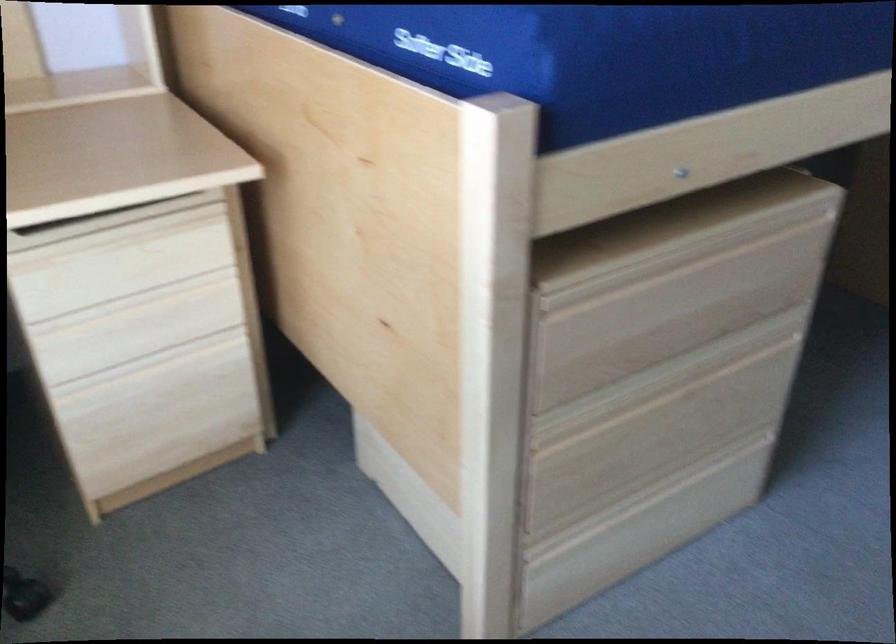
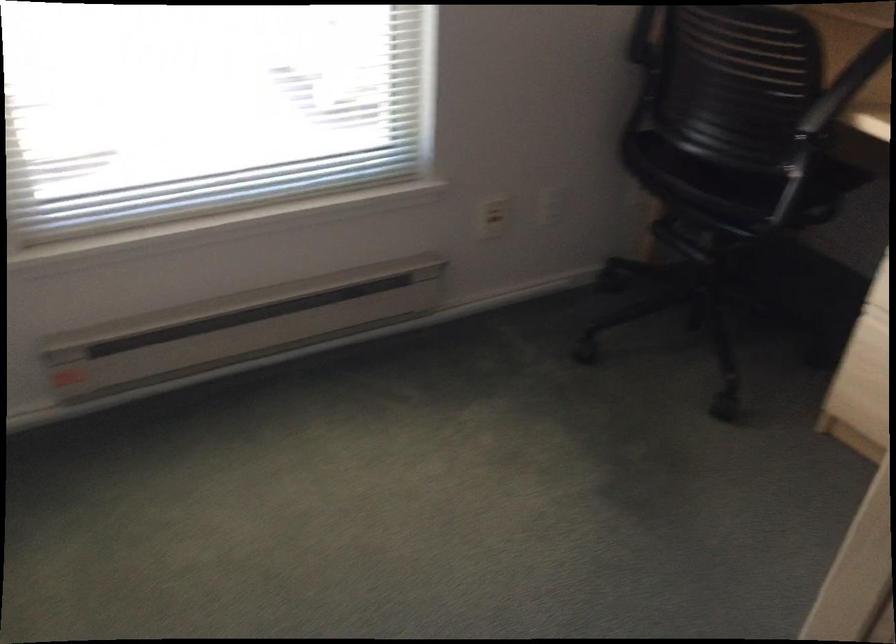
The first image is from the beginning of the video and the second image is from the end. How did the camera likely rotate when shooting the video?

The rotation direction of the camera is left-down.